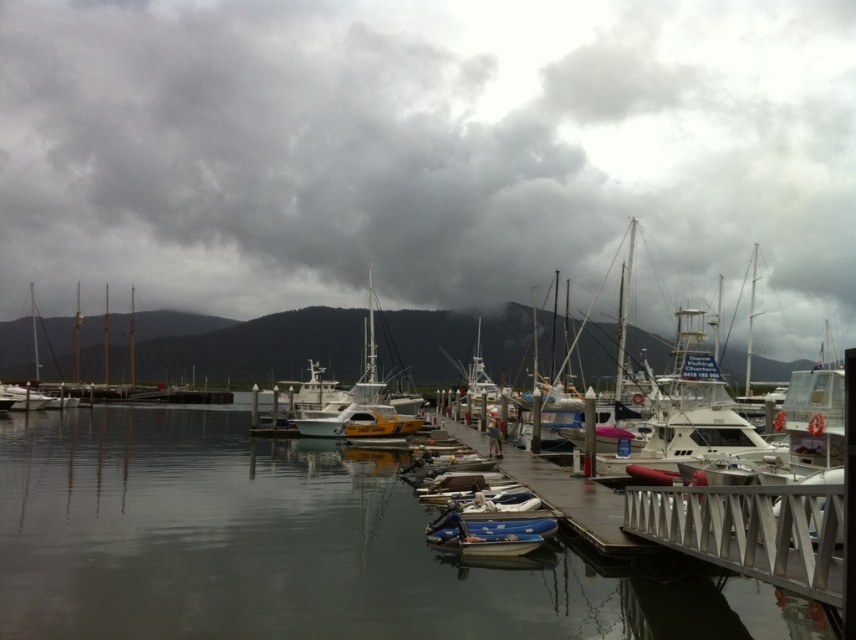
Question: Which point is farther from the camera taking this photo?

Choices:
 (A) click(x=308, y=113)
 (B) click(x=575, y=500)
 (C) click(x=373, y=397)

Answer: (A)

Question: Is glossy water at center positioned behind yellow matte boat at center?

Choices:
 (A) yes
 (B) no

Answer: (B)

Question: Is glossy water at center thinner than white glossy sailboat at left?

Choices:
 (A) yes
 (B) no

Answer: (A)

Question: Which point appears farthest from the camera in this image?

Choices:
 (A) (36, 342)
 (B) (805, 500)

Answer: (A)

Question: Can you confirm if dark gray cloud at upper center is thinner than yellow matte boat at center?

Choices:
 (A) no
 (B) yes

Answer: (A)

Question: Estimate the real-world distances between objects in this image. Which object is closer to the glossy water at center?

Choices:
 (A) metallic dock at center
 (B) yellow matte boat at center

Answer: (A)